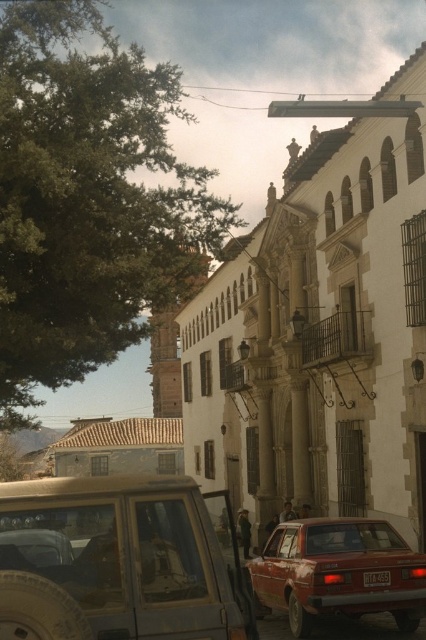
You are a delivery person who needs to park your 15 feet long truck between the metallic silver suv at center and the matte red sedan at lower right. Is there enough space between them to fit your truck?

The metallic silver suv at center and the matte red sedan at lower right are 18.40 feet apart from each other. Since your truck is 15 feet long, there is enough space between them to fit your truck.

You are a pedestrian standing on the sidewalk and see the metallic silver suv at center and the metallic red license plate at center. Which object is nearer to you?

The metallic silver suv at center is closer to the viewer than the metallic red license plate at center.

You are a delivery person trying to park your metallic silver suv at center in the parking spot next to the metallic red license plate at center. Based on the scene, can your suv fit in the parking spot without overlapping the license plate?

The metallic silver suv at center is bigger than the metallic red license plate at center. Since the suv is larger, it may not fit in the parking spot designated for the license plate without overlapping.